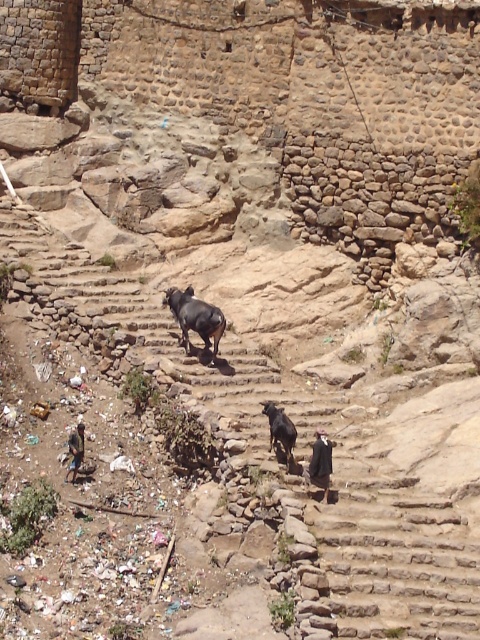
You are a hiker trying to navigate the rugged, rocky terrain depicted in the image. You notice a dark brown glossy cow at center. Where exactly is the cow positioned relative to the stone steps leading upwards?

The dark brown glossy cow at center is located at point 0.497 along the horizontal axis and 0.408 along the vertical axis, placing it centrally on the stone steps leading upwards.

You are a photographer trying to capture both the dark brown glossy cow at center and the black glossy cow at center in the same frame. Given that your camera has a fixed width, which cow would require you to zoom out more to include its entire body in the photo?

The dark brown glossy cow at center requires zooming out more because it is wider than the black glossy cow at center.